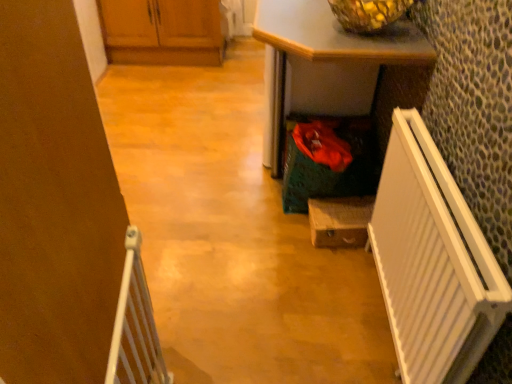
The width and height of the screenshot is (512, 384). In order to click on vacant space to the left of white plastic radiator at right, the second radiator viewed from the left in this screenshot , I will do `click(281, 313)`.